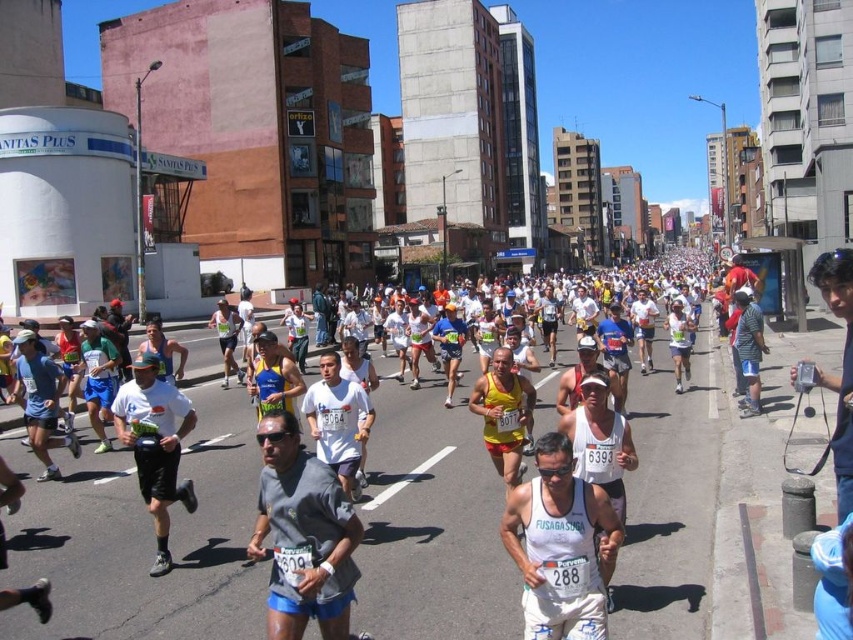
Question: Does gray matte shirt at center come behind white fabric shirt at center?

Choices:
 (A) no
 (B) yes

Answer: (A)

Question: Is gray matte shirt at center positioned in front of white mesh tank top at center?

Choices:
 (A) no
 (B) yes

Answer: (A)

Question: Which object is positioned closest to the white matte t-shirt at center?

Choices:
 (A) white mesh tank top at center
 (B) gray matte shirt at center

Answer: (B)

Question: Is white matte t-shirt at center above white fabric shirt at center?

Choices:
 (A) no
 (B) yes

Answer: (A)

Question: Which point appears closest to the camera in this image?

Choices:
 (A) (283, 417)
 (B) (126, 396)
 (C) (335, 410)
 (D) (515, 408)

Answer: (A)

Question: Which object appears farthest from the camera in this image?

Choices:
 (A) gray matte shirt at center
 (B) white mesh tank top at center
 (C) white fabric shirt at center
 (D) yellow matte shorts at center

Answer: (D)